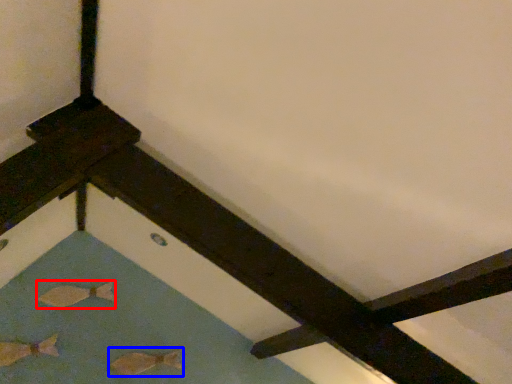
Question: Which point is further to the camera, fish (highlighted by a red box) or fish (highlighted by a blue box)?

Choices:
 (A) fish
 (B) fish

Answer: (A)